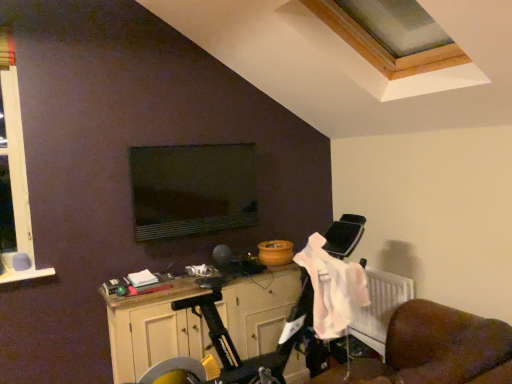
What do you see at coordinates (192, 189) in the screenshot? The image size is (512, 384). I see `matte black monitor at center` at bounding box center [192, 189].

I want to click on pink fabric at lower right, so click(332, 288).

Consider the image. From the image's perspective, between matte black monitor at center and pink fabric at lower right, which one is located above?

matte black monitor at center appears higher in the image.

Is matte black monitor at center not within pink fabric at lower right?

Indeed, matte black monitor at center is completely outside pink fabric at lower right.

Which is more to the left, matte black monitor at center or pink fabric at lower right?

matte black monitor at center is more to the left.

Consider the image. Considering the relative sizes of matte black monitor at center and pink fabric at lower right in the image provided, is matte black monitor at center smaller than pink fabric at lower right?

Yes, matte black monitor at center is smaller than pink fabric at lower right.

Which is more to the right, wooden cabinet at lower center or pink fabric at lower right?

From the viewer's perspective, pink fabric at lower right appears more on the right side.

How many degrees apart are the facing directions of wooden cabinet at lower center and pink fabric at lower right?

wooden cabinet at lower center and pink fabric at lower right are facing 87.5 degrees away from each other.

From a real-world perspective, which is physically above, wooden cabinet at lower center or pink fabric at lower right?

pink fabric at lower right is physically above.

Considering the relative sizes of wooden cabinet at lower center and pink fabric at lower right in the image provided, is wooden cabinet at lower center shorter than pink fabric at lower right?

No, wooden cabinet at lower center is not shorter than pink fabric at lower right.

Is pink fabric at lower right situated inside matte black monitor at center or outside?

pink fabric at lower right is outside matte black monitor at center.

Can you confirm if pink fabric at lower right is bigger than matte black monitor at center?

Yes, pink fabric at lower right is bigger than matte black monitor at center.

Is point (349, 320) less distant than point (206, 191)?

Yes.

From a real-world perspective, who is located higher, pink fabric at lower right or matte black monitor at center?

matte black monitor at center, from a real-world perspective.

Which point is more distant from viewer, (147, 227) or (120, 310)?

Positioned behind is point (147, 227).

From the image's perspective, relative to wooden cabinet at lower center, is matte black monitor at center above or below?

matte black monitor at center is situated higher than wooden cabinet at lower center in the image.

The height and width of the screenshot is (384, 512). Identify the location of laundry located above the wooden cabinet at lower center (from a real-world perspective). (332, 288).

Is pink fabric at lower right to the left of wooden cabinet at lower center from the viewer's perspective?

In fact, pink fabric at lower right is to the right of wooden cabinet at lower center.

Does pink fabric at lower right have a greater width compared to wooden cabinet at lower center?

In fact, pink fabric at lower right might be narrower than wooden cabinet at lower center.

Is pink fabric at lower right next to wooden cabinet at lower center and touching it?

No, pink fabric at lower right is not next to wooden cabinet at lower center.

Who is taller, wooden cabinet at lower center or matte black monitor at center?

wooden cabinet at lower center.

From a real-world perspective, does wooden cabinet at lower center stand above matte black monitor at center?

No.

Is the surface of wooden cabinet at lower center in direct contact with matte black monitor at center?

No, wooden cabinet at lower center is not making contact with matte black monitor at center.

Is wooden cabinet at lower center at the left side of matte black monitor at center?

Incorrect, wooden cabinet at lower center is not on the left side of matte black monitor at center.

What are the coordinates of `computer monitor above the pink fabric at lower right (from the image's perspective)` in the screenshot? It's located at (192, 189).

At what (x,y) coordinates should I click in order to perform the action: click on laundry that appears above the wooden cabinet at lower center (from a real-world perspective). Please return your answer as a coordinate pair (x, y). The height and width of the screenshot is (384, 512). Looking at the image, I should click on (332, 288).

Considering their positions, is matte black monitor at center positioned further to pink fabric at lower right than wooden cabinet at lower center?

matte black monitor at center is positioned further to the anchor pink fabric at lower right.

In the scene shown: Based on their spatial positions, is pink fabric at lower right or wooden cabinet at lower center further from matte black monitor at center?

The object further to matte black monitor at center is pink fabric at lower right.

When comparing their distances from wooden cabinet at lower center, does matte black monitor at center or pink fabric at lower right seem closer?

Based on the image, pink fabric at lower right appears to be nearer to wooden cabinet at lower center.

From the image, which object appears to be nearer to wooden cabinet at lower center, pink fabric at lower right or matte black monitor at center?

Based on the image, pink fabric at lower right appears to be nearer to wooden cabinet at lower center.

Looking at the image, which one is located closer to matte black monitor at center, wooden cabinet at lower center or pink fabric at lower right?

wooden cabinet at lower center is closer to matte black monitor at center.

Based on their spatial positions, is wooden cabinet at lower center or matte black monitor at center further from pink fabric at lower right?

The object further to pink fabric at lower right is matte black monitor at center.

Identify the location of laundry between matte black monitor at center and wooden cabinet at lower center from top to bottom. (332, 288).